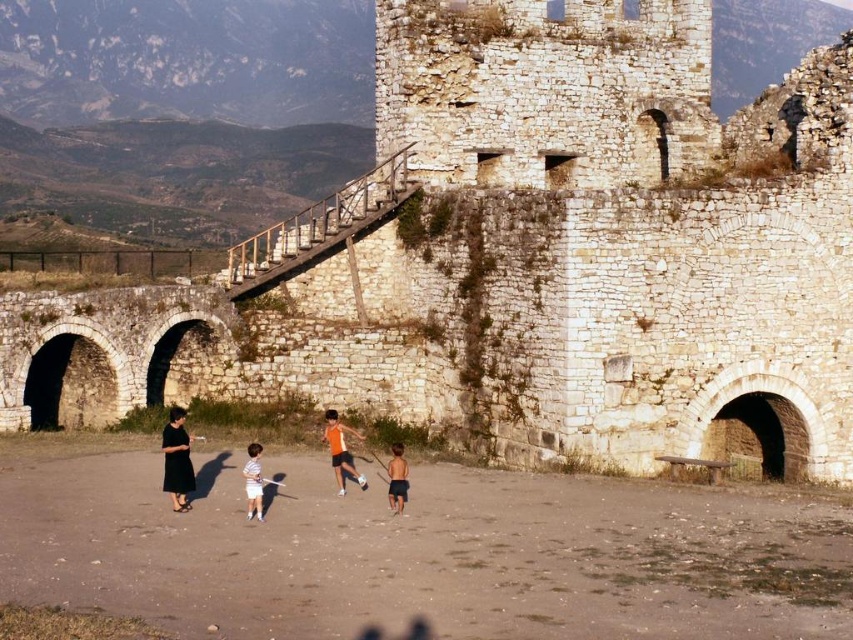
Looking at this image, can you confirm if striped cotton shirt at center is positioned above dark blue shorts at center?

Yes, striped cotton shirt at center is above dark blue shorts at center.

Can you confirm if striped cotton shirt at center is positioned to the right of dark blue shorts at center?

In fact, striped cotton shirt at center is to the left of dark blue shorts at center.

The width and height of the screenshot is (853, 640). Identify the location of striped cotton shirt at center. (253, 481).

Between point (167, 436) and point (344, 488), which one is positioned behind?

Positioned behind is point (344, 488).

Locate an element on the screen. black dress at lower left is located at coordinates (177, 460).

Describe the element at coordinates (177, 460) in the screenshot. I see `black dress at lower left` at that location.

Where is `black dress at lower left`? This screenshot has width=853, height=640. black dress at lower left is located at coordinates (177, 460).

Is point (358, 477) closer to camera compared to point (250, 499)?

No, it is not.

Consider the image. Does orange fabric shirt at center have a lesser height compared to striped cotton shirt at center?

No, orange fabric shirt at center is not shorter than striped cotton shirt at center.

You are a GUI agent. You are given a task and a screenshot of the screen. Output one action in this format:
    pyautogui.click(x=<x>, y=<y>)
    Task: Click on the orange fabric shirt at center
    The image size is (853, 640).
    Given the screenshot: What is the action you would take?
    pyautogui.click(x=340, y=451)